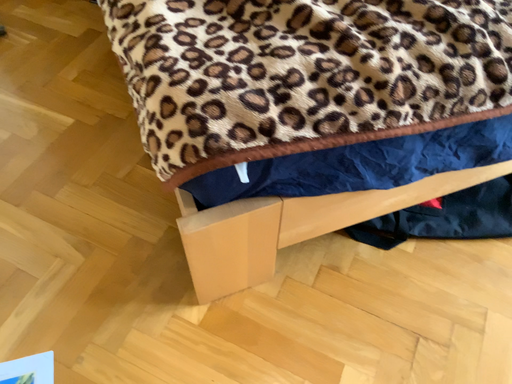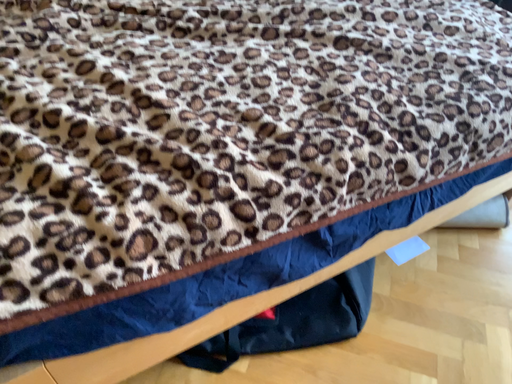
Question: Which way did the camera rotate in the video?

Choices:
 (A) rotated right
 (B) rotated left

Answer: (A)